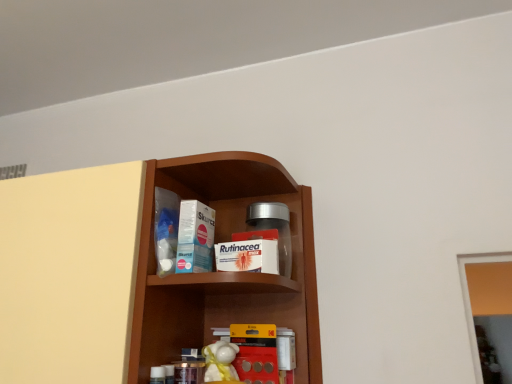
Where is `vacant area on top of wooden cabinet at center (from a real-world perspective)`? This screenshot has height=384, width=512. vacant area on top of wooden cabinet at center (from a real-world perspective) is located at coordinates (245, 177).